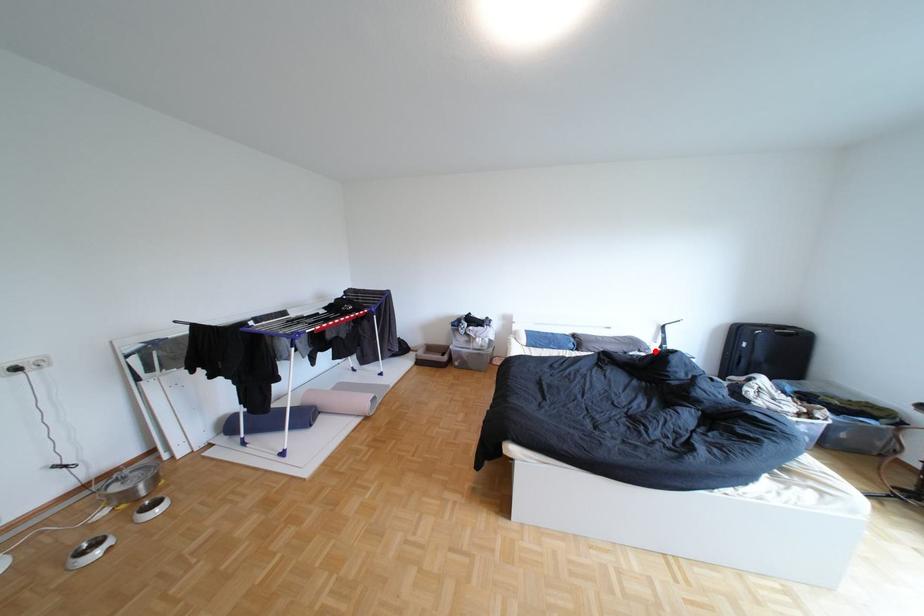
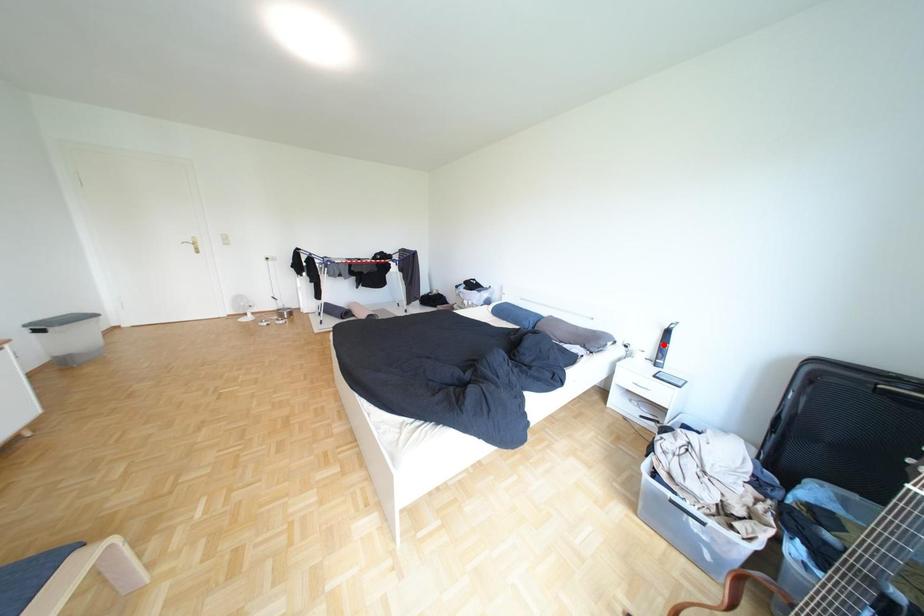
I am providing you with two images of the same scene from different viewpoints. A red point is marked on the first image and another point is marked on the second image. Do the highlighted points in image1 and image2 indicate the same real-world spot?

No